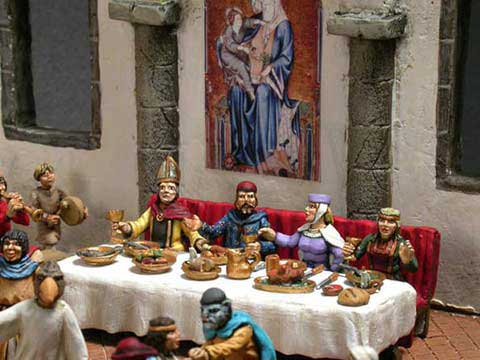
This screenshot has width=480, height=360. I want to click on toy figures, so click(x=14, y=208), click(x=46, y=202), click(x=10, y=243), click(x=39, y=316), click(x=158, y=351), click(x=213, y=335), click(x=175, y=223), click(x=237, y=228), click(x=297, y=239), click(x=389, y=253).